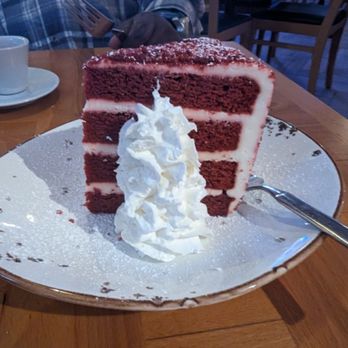
Where is `plate`? This screenshot has height=348, width=348. plate is located at coordinates (78, 239), (41, 78).